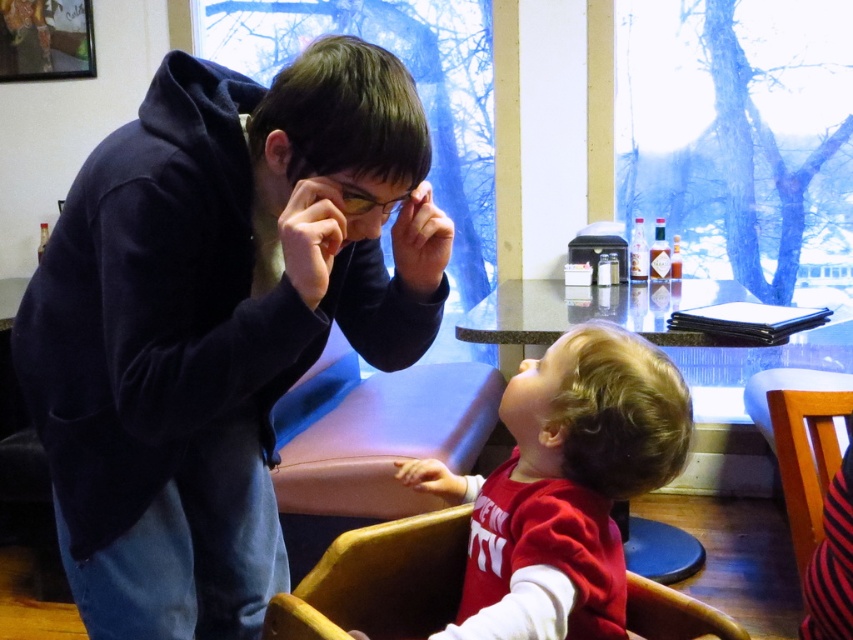
Is dark blue hoodie at upper left smaller than wooden chair at lower right?

Actually, dark blue hoodie at upper left might be larger than wooden chair at lower right.

Is dark blue hoodie at upper left further to the viewer compared to wooden chair at lower right?

No, it is in front of wooden chair at lower right.

Where is `dark blue hoodie at upper left`? The height and width of the screenshot is (640, 853). dark blue hoodie at upper left is located at coordinates (218, 321).

Between dark blue hoodie at upper left and matte red shirt at lower center, which one has more height?

dark blue hoodie at upper left

Is point (32, 419) positioned in front of point (506, 618)?

No, (32, 419) is further to viewer.

What are the coordinates of `dark blue hoodie at upper left` in the screenshot? It's located at (218, 321).

Is point (543, 541) in front of point (401, 586)?

Yes.

Who is lower down, matte red shirt at lower center or wooden chair at lower center?

Result: wooden chair at lower center

Does point (613, 353) come farther from viewer compared to point (408, 632)?

No, it is not.

At what (x,y) coordinates should I click in order to perform the action: click on matte red shirt at lower center. Please return your answer as a coordinate pair (x, y). Looking at the image, I should click on (564, 486).